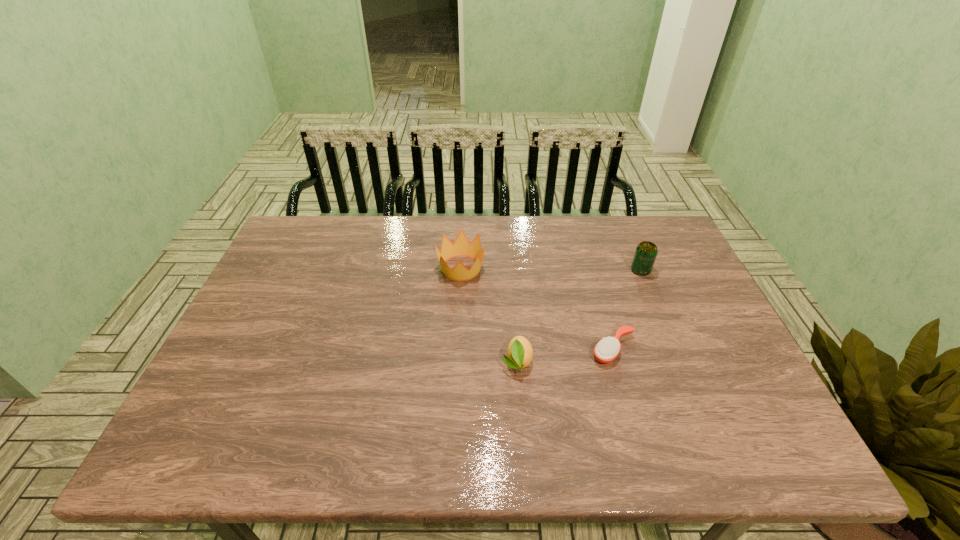
Locate an element on the screen. empty space between the lemon and the rightmost object is located at coordinates (579, 316).

This screenshot has width=960, height=540. I want to click on blank region between the second object from left to right and the shortest object, so click(565, 355).

Locate an element on the screen. The width and height of the screenshot is (960, 540). free spot between the second object from right to left and the rightmost object is located at coordinates (627, 310).

Identify the location of free space between the shortest object and the beer can. (627, 310).

I want to click on empty location between the beer can and the second object from left to right, so click(x=579, y=316).

The image size is (960, 540). I want to click on free space between the hairbrush and the third tallest object, so click(x=565, y=355).

The width and height of the screenshot is (960, 540). In order to click on vacant area that lies between the beer can and the second object from right to left in this screenshot , I will do `click(627, 310)`.

I want to click on the closest object to the beer can, so click(606, 350).

You are a GUI agent. You are given a task and a screenshot of the screen. Output one action in this format:
    pyautogui.click(x=<x>, y=<y>)
    Task: Click on the third closest object relative to the second shortest object
    The height and width of the screenshot is (540, 960).
    Given the screenshot: What is the action you would take?
    pyautogui.click(x=646, y=252)

Where is `free space in the image that satisfies the following two spatial constraints: 1. on the back side of the third object from left to right; 2. on the right side of the beer can`? free space in the image that satisfies the following two spatial constraints: 1. on the back side of the third object from left to right; 2. on the right side of the beer can is located at coordinates (591, 271).